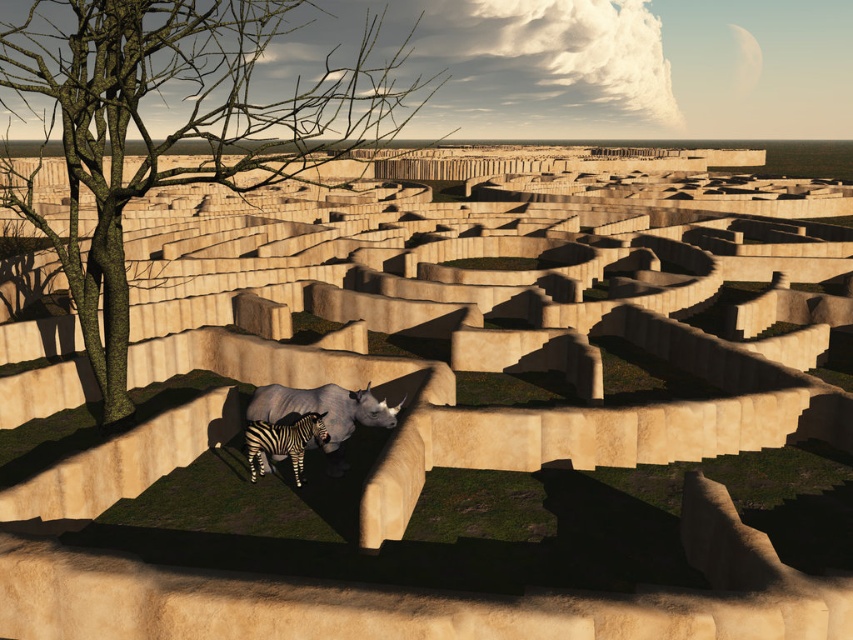
Is point (113, 154) farther from viewer compared to point (328, 429)?

That is True.

Which is more to the right, green leafy tree at left or gray matte rhino at center?

gray matte rhino at center

Who is more distant from viewer, (234, 136) or (329, 388)?

The point (329, 388) is more distant.

This screenshot has height=640, width=853. Identify the location of green leafy tree at left. (173, 128).

The height and width of the screenshot is (640, 853). What do you see at coordinates (323, 410) in the screenshot?
I see `gray matte rhino at center` at bounding box center [323, 410].

Between gray matte rhino at center and black and white striped zebra at center, which one appears on the right side from the viewer's perspective?

gray matte rhino at center

Which is behind, point (273, 403) or point (318, 440)?

Point (273, 403)

Where is `gray matte rhino at center`? Image resolution: width=853 pixels, height=640 pixels. gray matte rhino at center is located at coordinates point(323,410).

Can you confirm if green leafy tree at left is thinner than black and white striped zebra at center?

No.

Does green leafy tree at left come in front of black and white striped zebra at center?

Yes.

Where is `green leafy tree at left`? The width and height of the screenshot is (853, 640). green leafy tree at left is located at coordinates (173, 128).